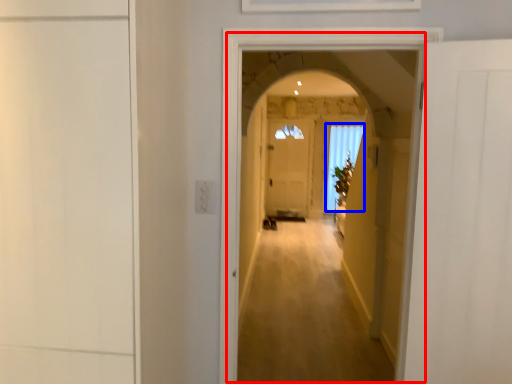
Question: Among these objects, which one is farthest to the camera, corridor (highlighted by a red box) or window (highlighted by a blue box)?

Choices:
 (A) corridor
 (B) window

Answer: (B)